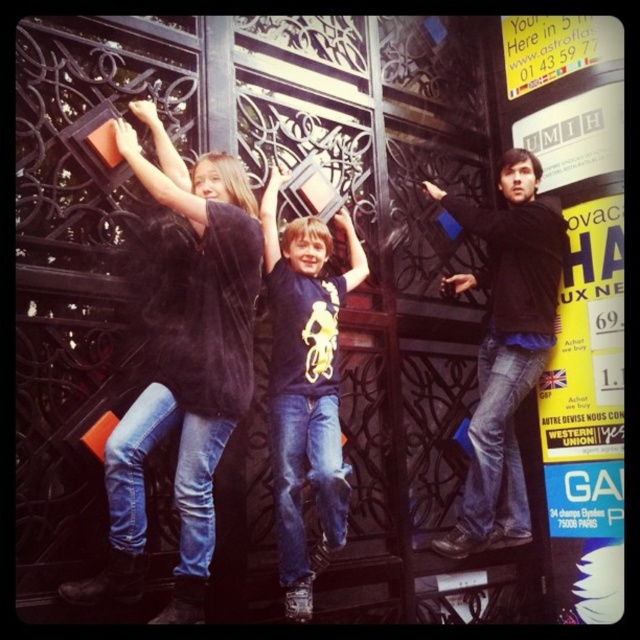
Question: Which point is closer to the camera?

Choices:
 (A) 506,513
 (B) 193,192
 (C) 292,588

Answer: (B)

Question: Does velvet black coat at left appear under matte blue t-shirt at center?

Choices:
 (A) no
 (B) yes

Answer: (A)

Question: Which point appears closest to the camera in this image?

Choices:
 (A) (460, 531)
 (B) (179, 588)
 (C) (280, 547)

Answer: (B)

Question: Is velvet black coat at left positioned before matte blue t-shirt at center?

Choices:
 (A) yes
 (B) no

Answer: (A)

Question: Which of the following is the closest to the observer?

Choices:
 (A) velvet black coat at left
 (B) matte blue t-shirt at center
 (C) matte black shirt at right

Answer: (A)

Question: Does velvet black coat at left appear over matte black shirt at right?

Choices:
 (A) yes
 (B) no

Answer: (A)